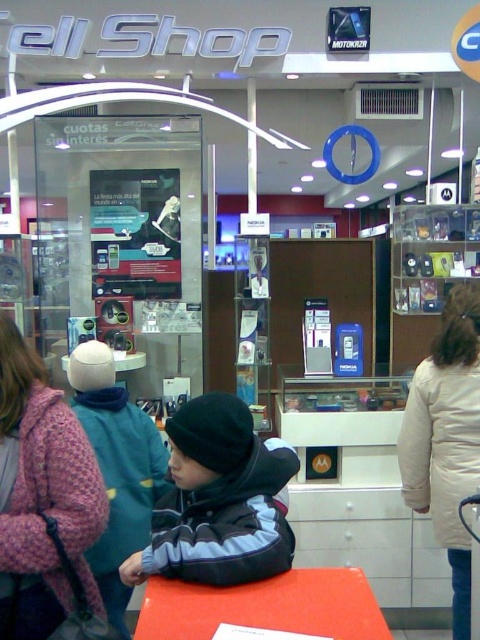
Is gray fleece jacket at center shorter than green fuzzy jacket at center?

Yes, gray fleece jacket at center is shorter than green fuzzy jacket at center.

Between point (167, 529) and point (105, 369), which one is positioned behind?

The point (105, 369) is behind.

This screenshot has width=480, height=640. Identify the location of gray fleece jacket at center. (218, 499).

Can you confirm if gray fleece jacket at center is taller than white wool coat at right?

No.

Is gray fleece jacket at center positioned before white wool coat at right?

Yes, gray fleece jacket at center is in front of white wool coat at right.

What do you see at coordinates (218, 499) in the screenshot? Image resolution: width=480 pixels, height=640 pixels. I see `gray fleece jacket at center` at bounding box center [218, 499].

Locate an element on the screen. gray fleece jacket at center is located at coordinates (218, 499).

Based on the photo, who is lower down, knitted pink sweater at left or smooth orange table at center?

smooth orange table at center is lower down.

I want to click on knitted pink sweater at left, so click(41, 496).

Is point (11, 451) positioned in front of point (330, 579)?

That is False.

Locate an element on the screen. This screenshot has width=480, height=640. knitted pink sweater at left is located at coordinates (41, 496).